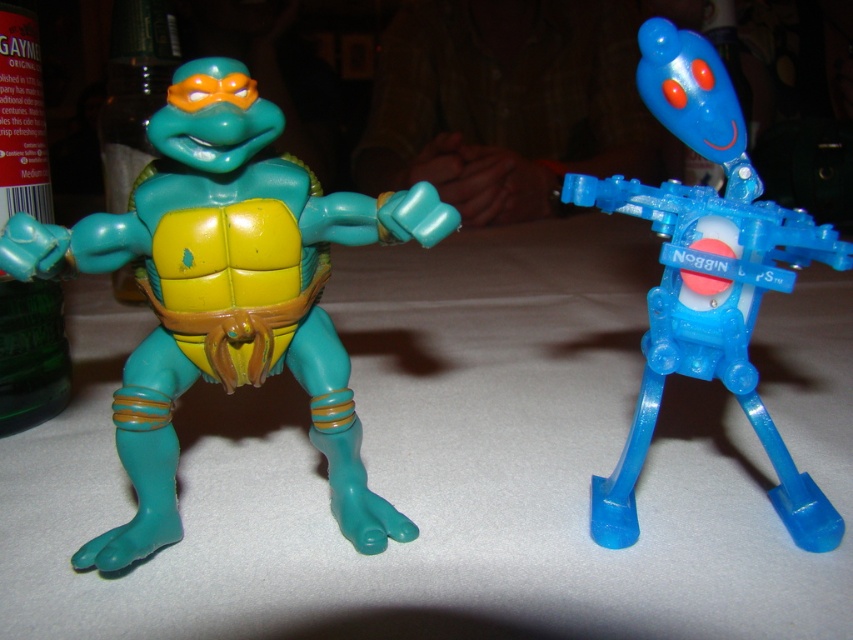
In the scene shown: You are a small toy that is 5 cm tall. You are currently standing on the white matte table at center. There is a point marked at coordinates (453, 464) on the table. Can you safely move to that point without falling off the table?

The point (453, 464) is on the white matte table at center, so yes, you can safely move to that point without falling off the table.

You are trying to place a new toy figure exactly between the Teenage Mutant Ninja Turtle Michelangelo and the Noggins robot toy on the white matte table at center. Can you determine the coordinates where you should place it?

The position of white matte table at center is at point (453, 464), so you should place the new toy figure at the center coordinates of the table, which is (453, 464).